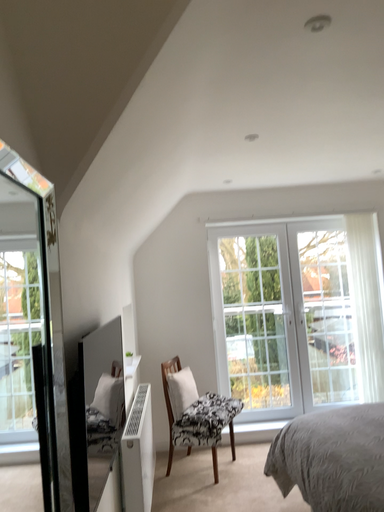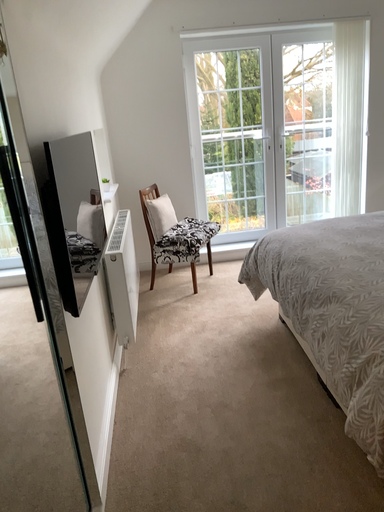
Question: Which way did the camera rotate in the video?

Choices:
 (A) rotated downward
 (B) rotated upward

Answer: (A)